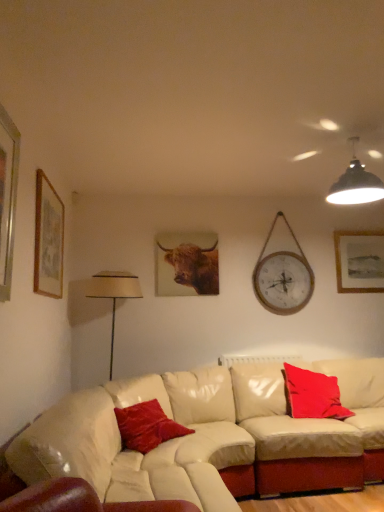
Question: Does velvet red pillow at center, which is counted as the 2th pillow, starting from the back, have a larger size compared to wooden framed artwork at upper right, marked as the third picture frame in a front-to-back arrangement?

Choices:
 (A) no
 (B) yes

Answer: (B)

Question: From a real-world perspective, is velvet red pillow at center, the first pillow when ordered from front to back, on wooden framed artwork at upper right, acting as the first picture frame starting from the back?

Choices:
 (A) yes
 (B) no

Answer: (B)

Question: Considering the relative sizes of velvet red pillow at center, positioned as the 1th pillow in left-to-right order, and wooden framed artwork at upper right, acting as the first picture frame starting from the back, in the image provided, is velvet red pillow at center, positioned as the 1th pillow in left-to-right order, thinner than wooden framed artwork at upper right, acting as the first picture frame starting from the back,?

Choices:
 (A) yes
 (B) no

Answer: (B)

Question: Is velvet red pillow at center, which is counted as the 2th pillow, starting from the back, located outside wooden framed artwork at upper right, the first picture frame positioned from the right?

Choices:
 (A) yes
 (B) no

Answer: (A)

Question: Does velvet red pillow at center, which is counted as the 2th pillow, starting from the back, lie behind wooden framed artwork at upper right, the 3th picture frame positioned from the left?

Choices:
 (A) no
 (B) yes

Answer: (A)

Question: From a real-world perspective, is black matte pendant light at upper right physically located above or below wooden framed artwork at upper right, acting as the first picture frame starting from the back?

Choices:
 (A) above
 (B) below

Answer: (A)

Question: From the image's perspective, is black matte pendant light at upper right above or below wooden framed artwork at upper right, marked as the third picture frame in a front-to-back arrangement?

Choices:
 (A) above
 (B) below

Answer: (A)

Question: Is black matte pendant light at upper right bigger or smaller than wooden framed artwork at upper right, marked as the third picture frame in a front-to-back arrangement?

Choices:
 (A) big
 (B) small

Answer: (A)

Question: Is point (360, 202) positioned closer to the camera than point (365, 276)?

Choices:
 (A) farther
 (B) closer

Answer: (B)

Question: Is wooden framed artwork at upper right, the first picture frame positioned from the right, to the left or to the right of brown furry cow at center in the image?

Choices:
 (A) right
 (B) left

Answer: (A)

Question: Looking at their shapes, would you say wooden framed artwork at upper right, the 3th picture frame positioned from the left, is wider or thinner than brown furry cow at center?

Choices:
 (A) wide
 (B) thin

Answer: (A)

Question: Which is correct: wooden framed artwork at upper right, marked as the third picture frame in a front-to-back arrangement, is inside brown furry cow at center, or outside of it?

Choices:
 (A) inside
 (B) outside

Answer: (B)

Question: Based on their sizes in the image, would you say wooden framed artwork at upper right, acting as the first picture frame starting from the back, is bigger or smaller than brown furry cow at center?

Choices:
 (A) small
 (B) big

Answer: (B)

Question: From the image's perspective, is velvet red pillow at center, positioned as the 1th pillow in left-to-right order, located above or below silver metallic picture frame at left, placed as the second picture frame when sorted from right to left?

Choices:
 (A) above
 (B) below

Answer: (B)

Question: Is point tap(122, 410) positioned closer to the camera than point tap(1, 296)?

Choices:
 (A) closer
 (B) farther

Answer: (B)